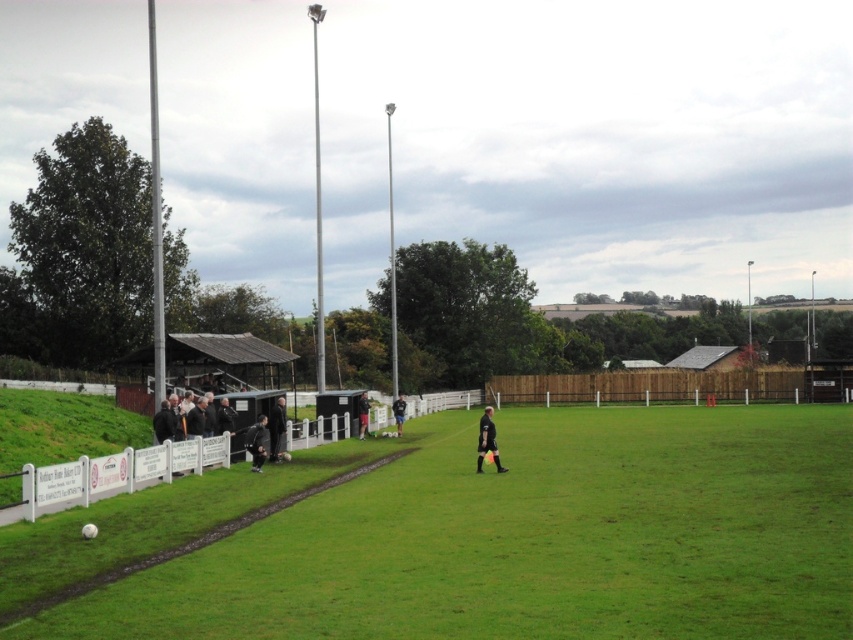
Question: Which point is farther from the camera taking this photo?

Choices:
 (A) (277, 452)
 (B) (363, 406)
 (C) (566, 618)
 (D) (401, 413)

Answer: (B)

Question: Can you confirm if green grass field at center is bigger than dark gray jacket at left?

Choices:
 (A) no
 (B) yes

Answer: (B)

Question: Is green grass field at center positioned at the back of dark gray uniform at center?

Choices:
 (A) yes
 (B) no

Answer: (B)

Question: Can you confirm if black matte soccer ball at center is positioned below dark gray jacket at left?

Choices:
 (A) yes
 (B) no

Answer: (A)

Question: Which point appears closest to the camera in this image?

Choices:
 (A) (279, 452)
 (B) (257, 468)
 (C) (364, 428)
 (D) (416, 550)

Answer: (D)

Question: Which point appears farthest from the camera in this image?

Choices:
 (A) (393, 410)
 (B) (254, 436)
 (C) (119, 595)
 (D) (502, 470)

Answer: (A)